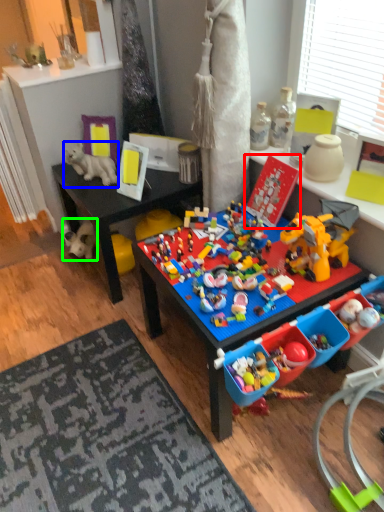
Question: Which object is the farthest from toy (highlighted by a red box)? Choose among these: toy (highlighted by a blue box) or toy (highlighted by a green box).

Choices:
 (A) toy
 (B) toy

Answer: (B)